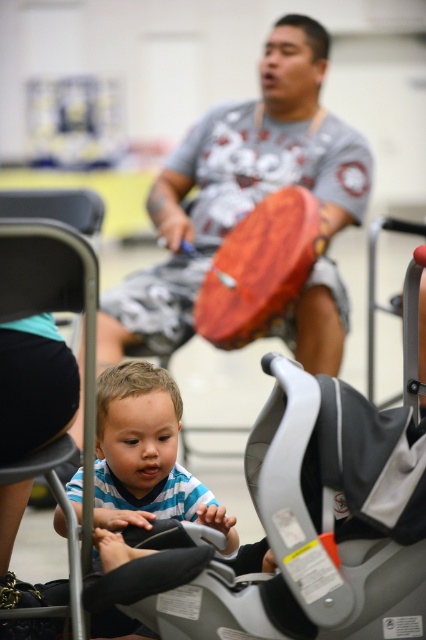
You are organizing a space for a community event and need to place the gray plastic baby carriage at center and the black fabric chair at lower left. If the area you have is only 1.2 meters wide, will both items fit side by side?

The gray plastic baby carriage at center is larger than the black fabric chair at lower left. Since the combined width of both items may exceed 1.2 meters, they might not fit side by side in the available space.

What object is located at the coordinates point (239, 182) in the image?

The gray cotton t shirt at center is located at point (239, 182).